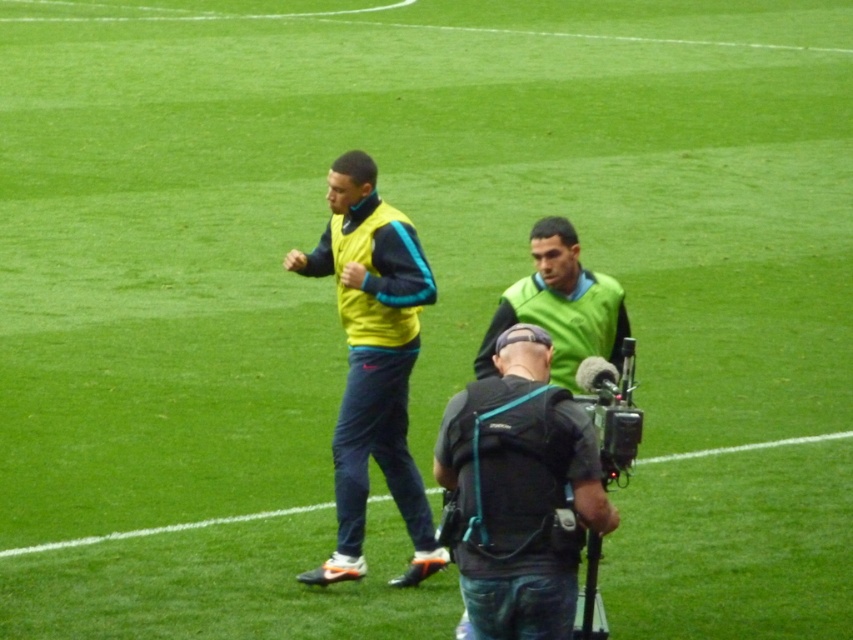
Between yellow matte vest at center and green matte vest at center, which one has more height?

yellow matte vest at center

Who is more distant from viewer, (374,305) or (548,250)?

The point (374,305) is behind.

Is point (432, 276) closer to viewer compared to point (579, 296)?

No, (432, 276) is behind (579, 296).

At what (x,y) coordinates should I click in order to perform the action: click on yellow matte vest at center. Please return your answer as a coordinate pair (x, y). Image resolution: width=853 pixels, height=640 pixels. Looking at the image, I should click on (372, 364).

Does yellow matte vest at center have a greater height compared to black fabric camera at lower center?

Yes, yellow matte vest at center is taller than black fabric camera at lower center.

Can you confirm if yellow matte vest at center is positioned to the right of black fabric camera at lower center?

Correct, you'll find yellow matte vest at center to the right of black fabric camera at lower center.

Is point (387, 470) closer to viewer compared to point (312, 512)?

Yes, point (387, 470) is closer to viewer.

At what (x,y) coordinates should I click in order to perform the action: click on yellow matte vest at center. Please return your answer as a coordinate pair (x, y). Looking at the image, I should click on (372, 364).

Which of these two, black fabric camera at center or yellow matte vest at center, stands shorter?

With less height is black fabric camera at center.

Does black fabric camera at center appear over yellow matte vest at center?

No, black fabric camera at center is not above yellow matte vest at center.

Is point (448, 436) closer to camera compared to point (361, 547)?

Yes, point (448, 436) is in front of point (361, 547).

Locate an element on the screen. Image resolution: width=853 pixels, height=640 pixels. black fabric camera at center is located at coordinates (520, 492).